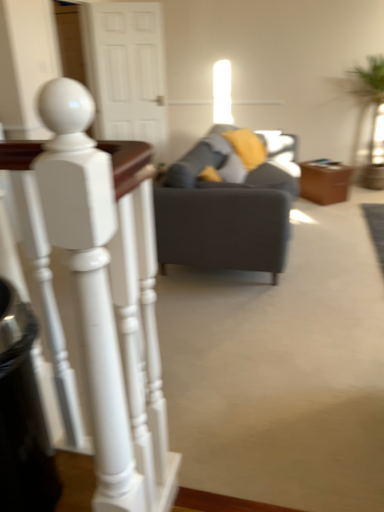
The image size is (384, 512). Find the location of `free location in front of brown leather side table at center`. free location in front of brown leather side table at center is located at coordinates (337, 211).